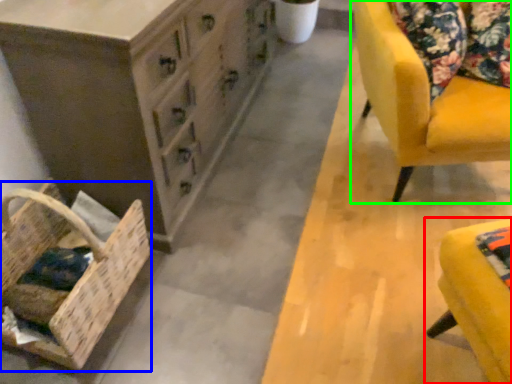
Question: Which object is positioned closest to furniture (highlighted by a red box)? Select from basket (highlighted by a blue box) and chair (highlighted by a green box).

Choices:
 (A) basket
 (B) chair

Answer: (B)